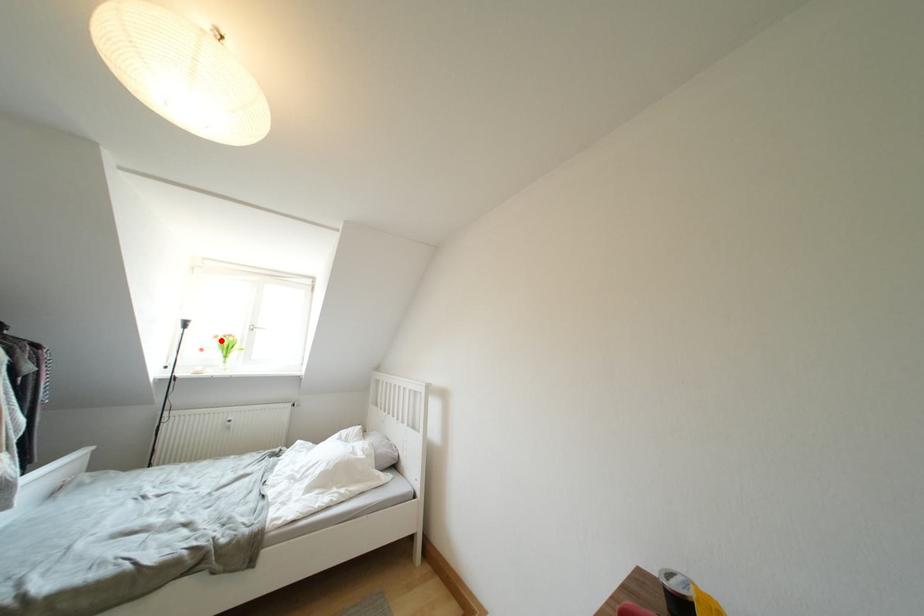
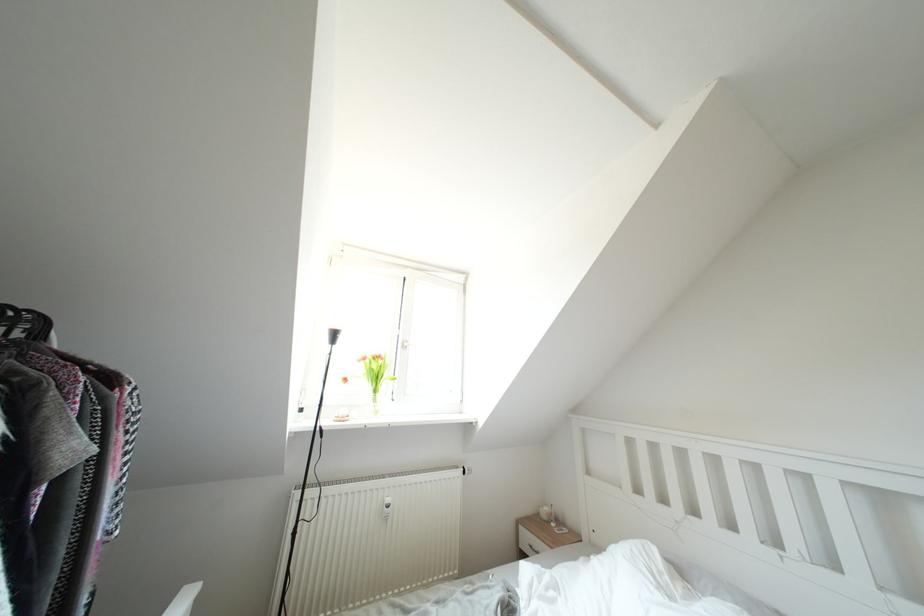
In the second image, find the point that corresponds to the highlighted location in the first image.

(370, 363)